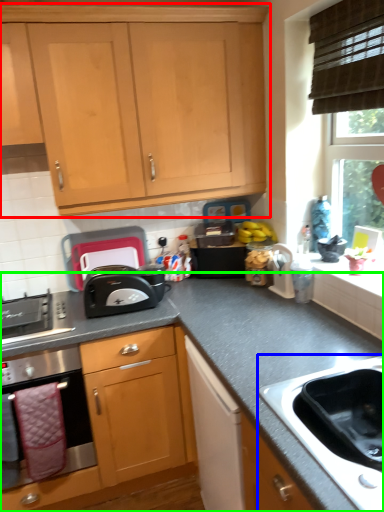
Question: Estimate the real-world distances between objects in this image. Which object is closer to cabinetry (highlighted by a red box), sink (highlighted by a blue box) or countertop (highlighted by a green box)?

Choices:
 (A) sink
 (B) countertop

Answer: (B)